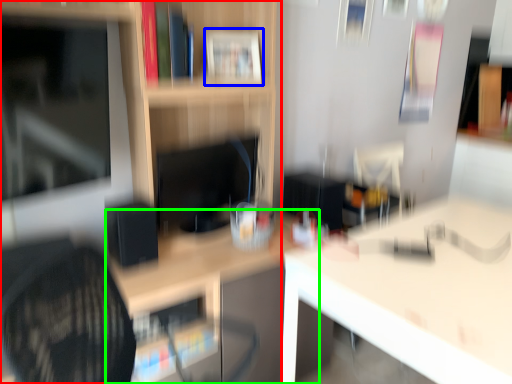
Question: Which is farther away from shelf (highlighted by a red box)? book (highlighted by a blue box) or table (highlighted by a green box)?

Choices:
 (A) book
 (B) table

Answer: (B)